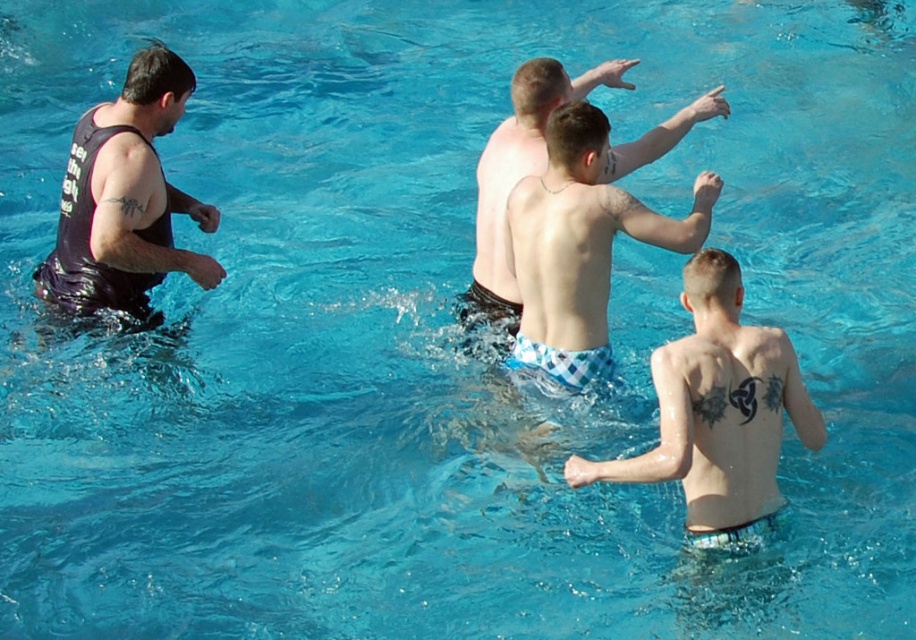
Question: Does checkered fabric shorts at center appear under light blue checkered shorts at center?

Choices:
 (A) yes
 (B) no

Answer: (A)

Question: Does matte black tank top at left have a larger size compared to light blue checkered shorts at center?

Choices:
 (A) yes
 (B) no

Answer: (B)

Question: Among these points, which one is nearest to the camera?

Choices:
 (A) (570, 93)
 (B) (94, 259)
 (C) (690, 432)

Answer: (C)

Question: Which point is farther to the camera?

Choices:
 (A) (495, 240)
 (B) (144, 132)

Answer: (B)

Question: Can you confirm if checkered fabric shorts at center is positioned above matte black tank top at left?

Choices:
 (A) no
 (B) yes

Answer: (A)

Question: Among these points, which one is farthest from the camera?

Choices:
 (A) (140, 310)
 (B) (732, 435)

Answer: (A)